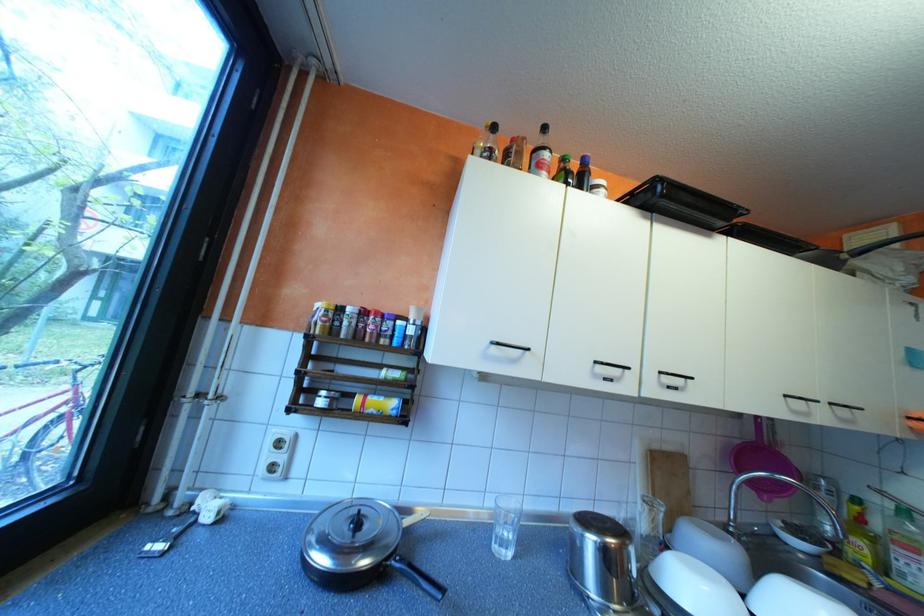
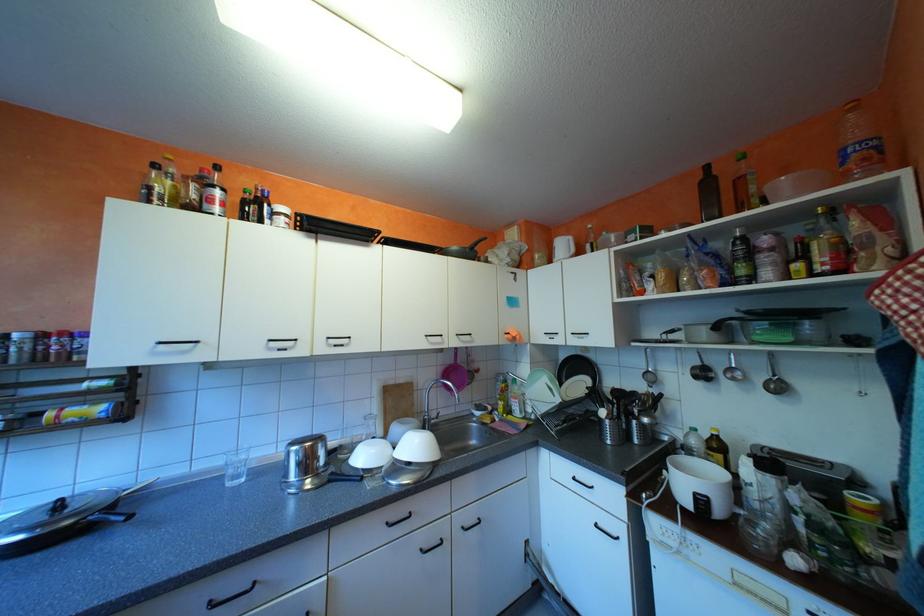
Question: The camera is either moving clockwise (left) or counter-clockwise (right) around the object. The first image is from the beginning of the video and the second image is from the end. Is the camera moving left or right when shooting the video?

Choices:
 (A) Left
 (B) Right

Answer: (A)